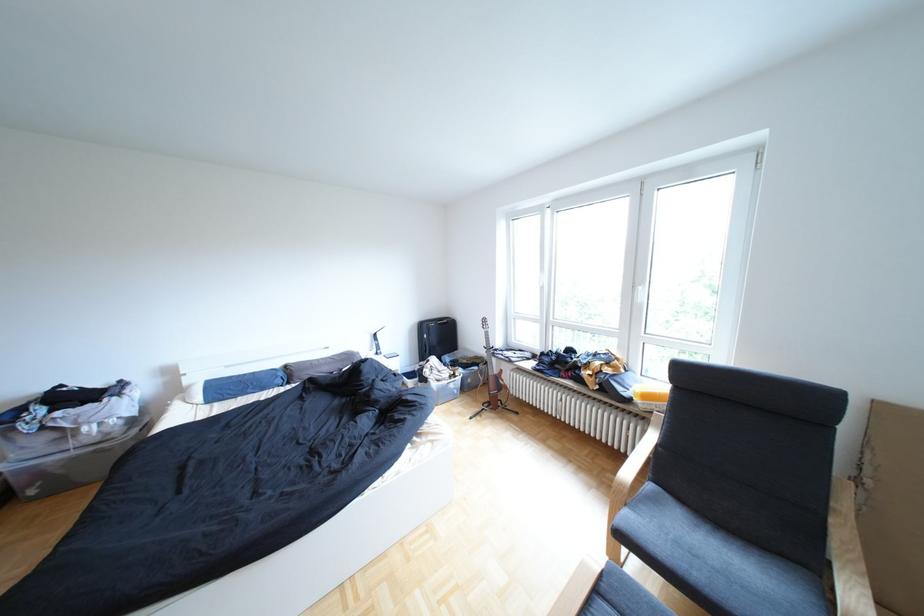
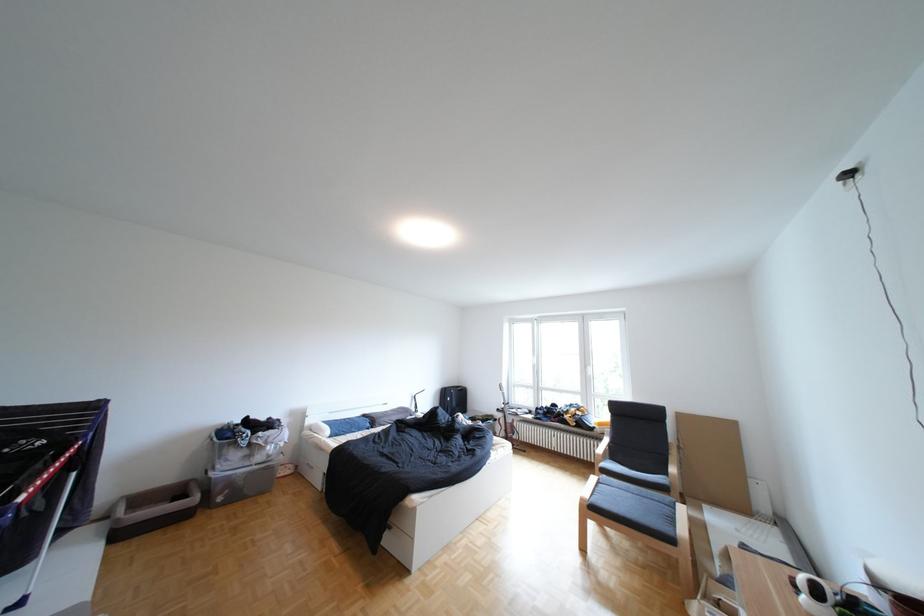
In a continuous first-person perspective shot, in which direction is the camera moving?

The cameraman moved toward left, backward.